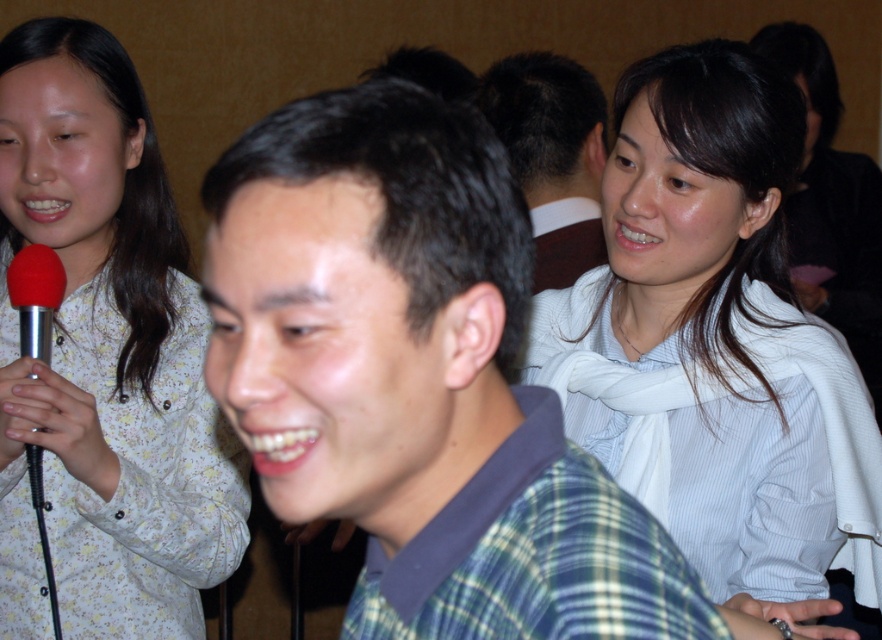
Can you confirm if green plaid shirt at center is positioned above red rubber microphone at left?

Indeed, green plaid shirt at center is positioned over red rubber microphone at left.

Who is more forward, (286, 493) or (36, 273)?

Point (286, 493) is more forward.

Find the location of a particular element. This screenshot has height=640, width=882. green plaid shirt at center is located at coordinates (417, 380).

Who is lower down, green plaid shirt at center or white floral shirt at upper left?

Positioned lower is green plaid shirt at center.

You are a GUI agent. You are given a task and a screenshot of the screen. Output one action in this format:
    pyautogui.click(x=<x>, y=<y>)
    Task: Click on the green plaid shirt at center
    The width and height of the screenshot is (882, 640).
    Given the screenshot: What is the action you would take?
    pyautogui.click(x=417, y=380)

Which is more to the left, green plaid shirt at center or dark brown hair at upper right?

green plaid shirt at center is more to the left.

At what (x,y) coordinates should I click in order to perform the action: click on green plaid shirt at center. Please return your answer as a coordinate pair (x, y). Looking at the image, I should click on (417, 380).